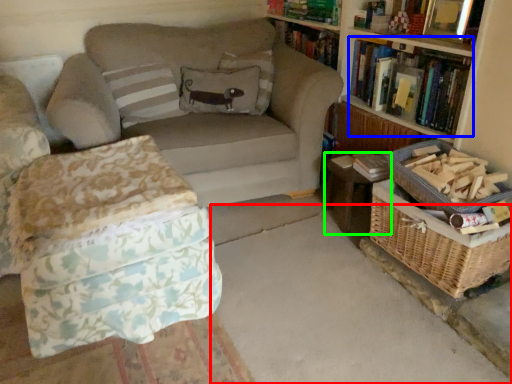
Question: Based on their relative distances, which object is nearer to concrete (highlighted by a red box)? Choose from book (highlighted by a blue box) and table (highlighted by a green box).

Choices:
 (A) book
 (B) table

Answer: (B)